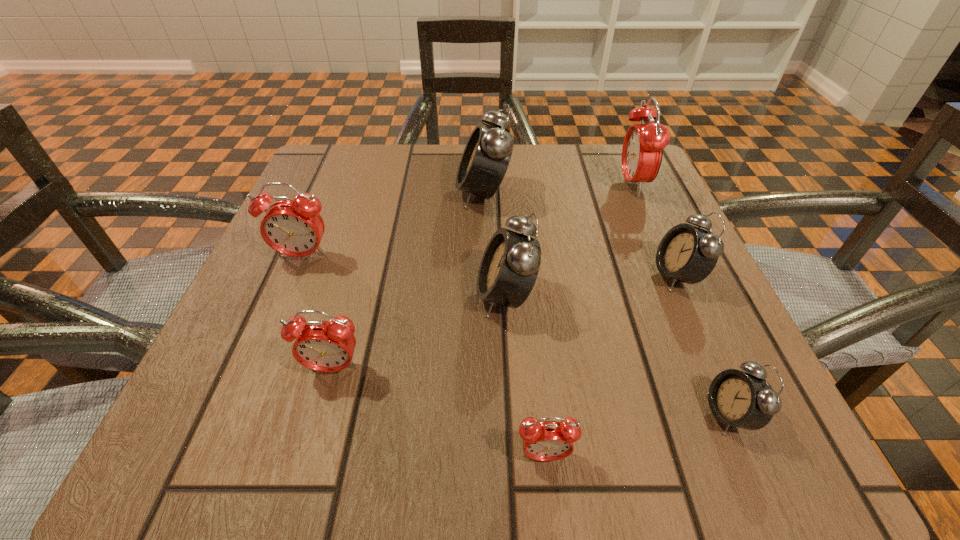
Find the location of a particular element. free space between the second smallest red alarm clock and the biggest white alarm clock is located at coordinates (408, 281).

The image size is (960, 540). What are the coordinates of `free space between the second biggest white alarm clock and the leftmost alarm clock` in the screenshot? It's located at (404, 276).

You are a GUI agent. You are given a task and a screenshot of the screen. Output one action in this format:
    pyautogui.click(x=<x>, y=<y>)
    Task: Click on the unoccupied area between the third biggest white alarm clock and the farthest red alarm clock
    The image size is (960, 540).
    Given the screenshot: What is the action you would take?
    pyautogui.click(x=655, y=230)

This screenshot has height=540, width=960. I want to click on vacant area that lies between the third red alarm clock from right to left and the farthest white alarm clock, so click(408, 281).

The height and width of the screenshot is (540, 960). I want to click on free spot between the second nearest red alarm clock and the farthest white alarm clock, so click(408, 281).

Where is `blank region between the leftmost red alarm clock and the smallest red alarm clock`? blank region between the leftmost red alarm clock and the smallest red alarm clock is located at coordinates (423, 356).

Find the location of a particular element. The image size is (960, 540). free space between the third biggest white alarm clock and the nearest alarm clock is located at coordinates (611, 366).

Where is `free space that is in between the second nearest alarm clock and the second biggest red alarm clock`? This screenshot has width=960, height=540. free space that is in between the second nearest alarm clock and the second biggest red alarm clock is located at coordinates (516, 335).

Identify the location of object that is the closest to the nearest object. (745, 400).

Identify which object is located as the second nearest to the leftmost alarm clock. Please provide its 2D coordinates. Your answer should be formatted as a tuple, i.e. [(x, y)], where the tuple contains the x and y coordinates of a point satisfying the conditions above.

[(486, 157)]